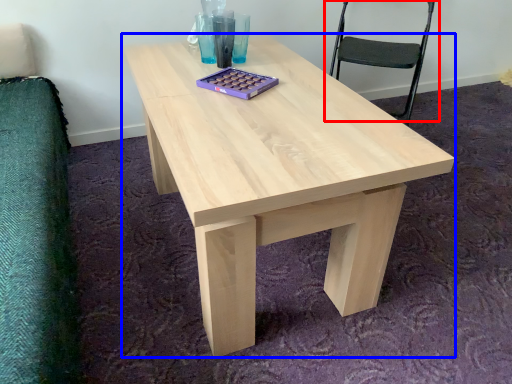
Question: Which object is closer to the camera taking this photo, chair (highlighted by a red box) or coffee table (highlighted by a blue box)?

Choices:
 (A) chair
 (B) coffee table

Answer: (B)